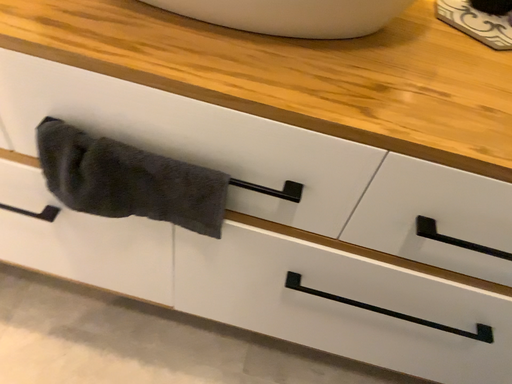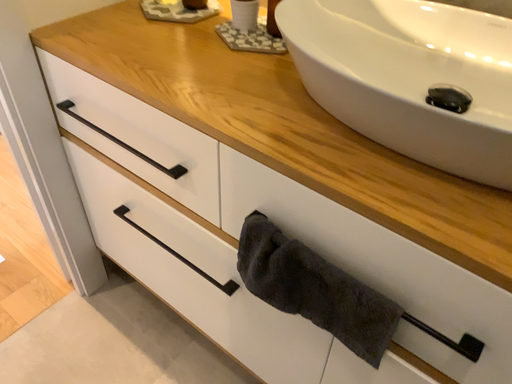
Question: Which way did the camera rotate in the video?

Choices:
 (A) rotated right
 (B) rotated left

Answer: (B)